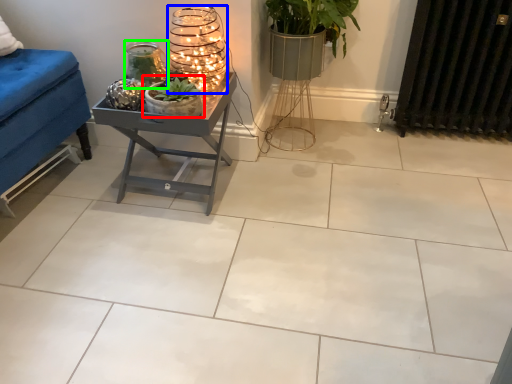
Question: Considering the real-world distances, which object is closest to houseplant (highlighted by a red box)? candle holder (highlighted by a blue box) or candle holder (highlighted by a green box).

Choices:
 (A) candle holder
 (B) candle holder

Answer: (B)